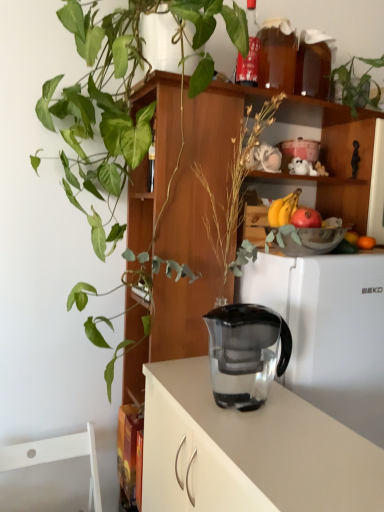
The width and height of the screenshot is (384, 512). I want to click on vacant area that lies in front of transparent glass vase at center, so click(x=286, y=448).